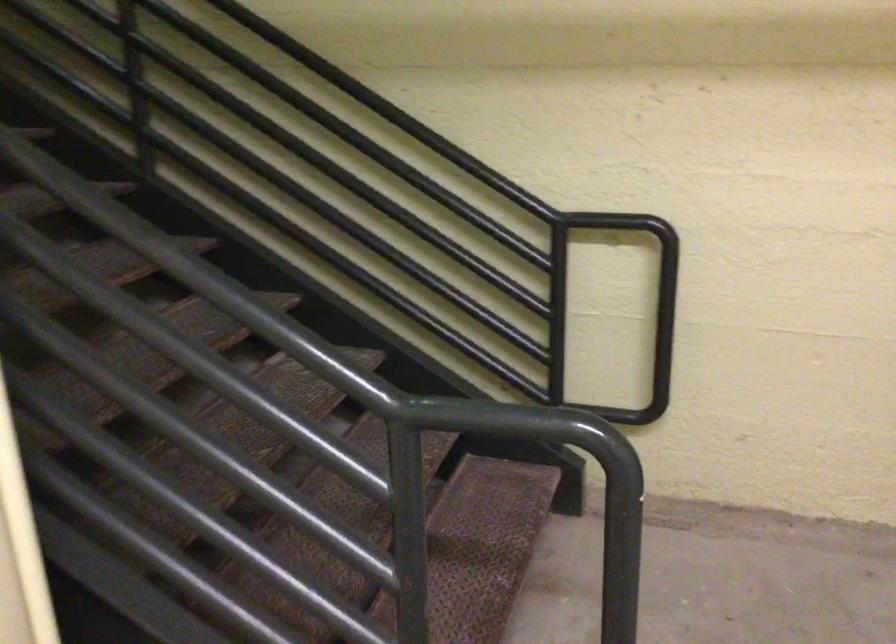
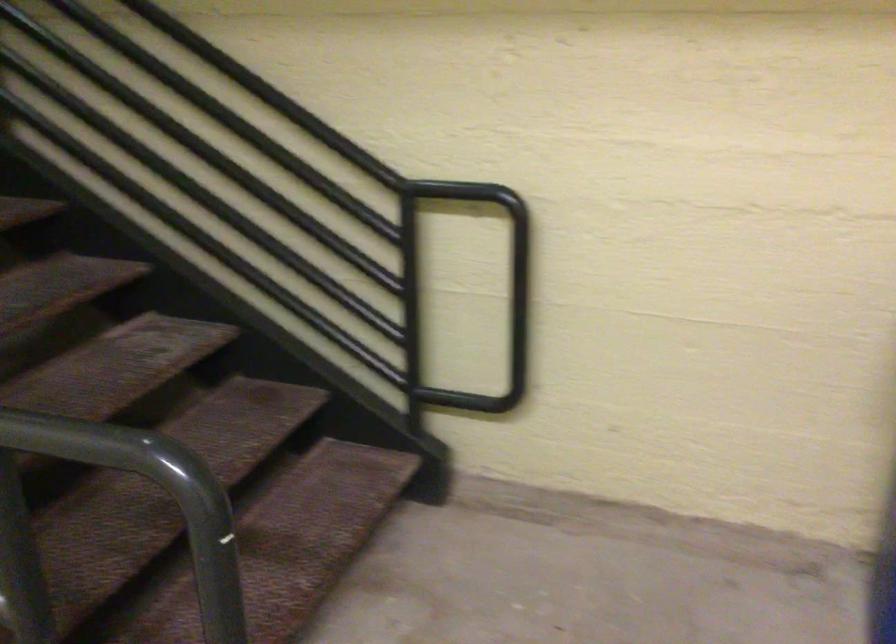
Locate, in the second image, the point that corresponds to (418,136) in the first image.

(265, 91)